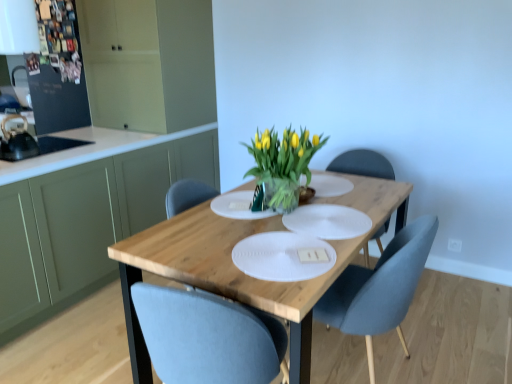
Question: Considering the relative sizes of translucent glass vase at center and green matte cabinet at left, placed as the 2th cabinetry when sorted from bottom to top, in the image provided, is translucent glass vase at center thinner than green matte cabinet at left, placed as the 2th cabinetry when sorted from bottom to top,?

Choices:
 (A) no
 (B) yes

Answer: (B)

Question: Is translucent glass vase at center taller than green matte cabinet at left, which is the 1th cabinetry from top to bottom?

Choices:
 (A) yes
 (B) no

Answer: (B)

Question: Does translucent glass vase at center have a lesser height compared to green matte cabinet at left, placed as the 2th cabinetry when sorted from bottom to top?

Choices:
 (A) no
 (B) yes

Answer: (B)

Question: Is translucent glass vase at center wider than green matte cabinet at left, which is the 1th cabinetry from top to bottom?

Choices:
 (A) yes
 (B) no

Answer: (B)

Question: Is translucent glass vase at center oriented away from green matte cabinet at left, placed as the 2th cabinetry when sorted from bottom to top?

Choices:
 (A) yes
 (B) no

Answer: (B)

Question: Looking at the image, does black matte kettle at left, which appears as the second appliance when viewed from the top, seem bigger or smaller compared to translucent glass vase at center?

Choices:
 (A) big
 (B) small

Answer: (B)

Question: From the image's perspective, is black matte kettle at left, marked as the first appliance in a bottom-to-top arrangement, positioned above or below translucent glass vase at center?

Choices:
 (A) above
 (B) below

Answer: (A)

Question: In terms of width, does black matte kettle at left, marked as the first appliance in a bottom-to-top arrangement, look wider or thinner when compared to translucent glass vase at center?

Choices:
 (A) wide
 (B) thin

Answer: (B)

Question: Is black matte kettle at left, which ranks as the second appliance in back-to-front order, in front of or behind translucent glass vase at center in the image?

Choices:
 (A) front
 (B) behind

Answer: (B)

Question: Is green matte cabinet at left, which is the 1th cabinetry in bottom-to-top order, in front of or behind translucent glass vase at center in the image?

Choices:
 (A) front
 (B) behind

Answer: (B)

Question: Does point (52, 271) appear closer or farther from the camera than point (284, 190)?

Choices:
 (A) farther
 (B) closer

Answer: (A)

Question: Looking at the image, does green matte cabinet at left, the second cabinetry positioned from the top, seem bigger or smaller compared to translucent glass vase at center?

Choices:
 (A) big
 (B) small

Answer: (A)

Question: Is green matte cabinet at left, the second cabinetry positioned from the top, taller or shorter than translucent glass vase at center?

Choices:
 (A) short
 (B) tall

Answer: (B)

Question: Considering their positions, is wooden table at center located in front of or behind green matte cabinet at left, which is the 1th cabinetry from top to bottom?

Choices:
 (A) front
 (B) behind

Answer: (A)

Question: Is wooden table at center wider or thinner than green matte cabinet at left, placed as the 2th cabinetry when sorted from bottom to top?

Choices:
 (A) thin
 (B) wide

Answer: (B)